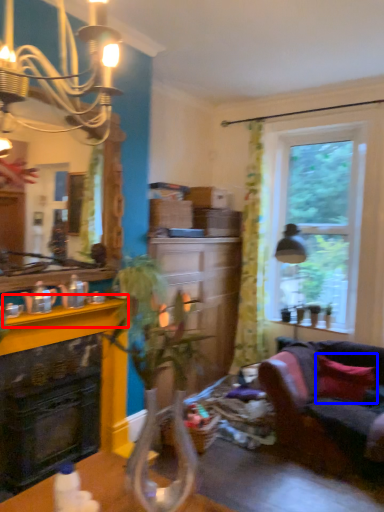
Question: Which point is further to the camera, counter top (highlighted by a red box) or pillow (highlighted by a blue box)?

Choices:
 (A) counter top
 (B) pillow

Answer: (B)